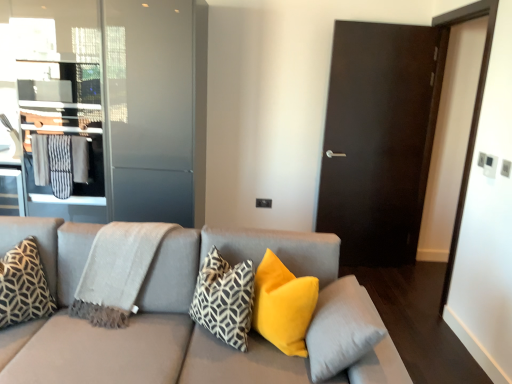
Question: Is velvet yellow pillow at center, placed as the third pillow when sorted from left to right, to the left of geometric-patterned fabric pillow at center, the 2th pillow when ordered from left to right, from the viewer's perspective?

Choices:
 (A) yes
 (B) no

Answer: (B)

Question: From a real-world perspective, does velvet yellow pillow at center, marked as the second pillow in a right-to-left arrangement, sit lower than geometric-patterned fabric pillow at center, the 2th pillow when ordered from left to right?

Choices:
 (A) yes
 (B) no

Answer: (A)

Question: Is velvet yellow pillow at center, placed as the third pillow when sorted from left to right, oriented away from geometric-patterned fabric pillow at center, the 3th pillow in the right-to-left sequence?

Choices:
 (A) yes
 (B) no

Answer: (B)

Question: From the image's perspective, is velvet yellow pillow at center, placed as the third pillow when sorted from left to right, on geometric-patterned fabric pillow at center, the 3th pillow in the right-to-left sequence?

Choices:
 (A) no
 (B) yes

Answer: (A)

Question: Considering the relative sizes of velvet yellow pillow at center, marked as the second pillow in a right-to-left arrangement, and geometric-patterned fabric pillow at center, the 3th pillow in the right-to-left sequence, in the image provided, is velvet yellow pillow at center, marked as the second pillow in a right-to-left arrangement, shorter than geometric-patterned fabric pillow at center, the 3th pillow in the right-to-left sequence,?

Choices:
 (A) no
 (B) yes

Answer: (B)

Question: In terms of size, does light gray woven blanket at left appear bigger or smaller than metallic glass elevator at left?

Choices:
 (A) big
 (B) small

Answer: (B)

Question: Would you say light gray woven blanket at left is to the left or to the right of metallic glass elevator at left in the picture?

Choices:
 (A) left
 (B) right

Answer: (B)

Question: Which is correct: light gray woven blanket at left is inside metallic glass elevator at left, or outside of it?

Choices:
 (A) outside
 (B) inside

Answer: (A)

Question: Considering the positions of light gray woven blanket at left and metallic glass elevator at left in the image, is light gray woven blanket at left wider or thinner than metallic glass elevator at left?

Choices:
 (A) thin
 (B) wide

Answer: (A)

Question: In the image, is metallic glass elevator at left on the left side or the right side of transparent glass screen door at upper left?

Choices:
 (A) right
 (B) left

Answer: (B)

Question: From the image's perspective, is metallic glass elevator at left positioned above or below transparent glass screen door at upper left?

Choices:
 (A) above
 (B) below

Answer: (A)

Question: From a real-world perspective, is metallic glass elevator at left physically located above or below transparent glass screen door at upper left?

Choices:
 (A) above
 (B) below

Answer: (B)

Question: Is metallic glass elevator at left bigger or smaller than transparent glass screen door at upper left?

Choices:
 (A) big
 (B) small

Answer: (B)

Question: Relative to matte gray couch at center, is soft yellow pillow at center, which ranks as the 4th pillow in left-to-right order, in front or behind?

Choices:
 (A) front
 (B) behind

Answer: (B)

Question: Considering the positions of soft yellow pillow at center, which appears as the first pillow when viewed from the right, and matte gray couch at center in the image, is soft yellow pillow at center, which appears as the first pillow when viewed from the right, bigger or smaller than matte gray couch at center?

Choices:
 (A) big
 (B) small

Answer: (B)